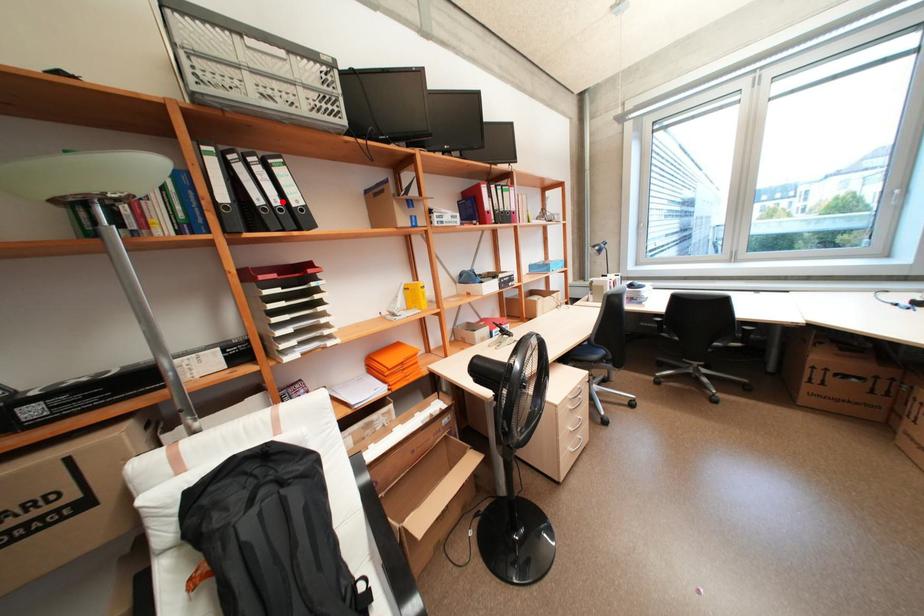
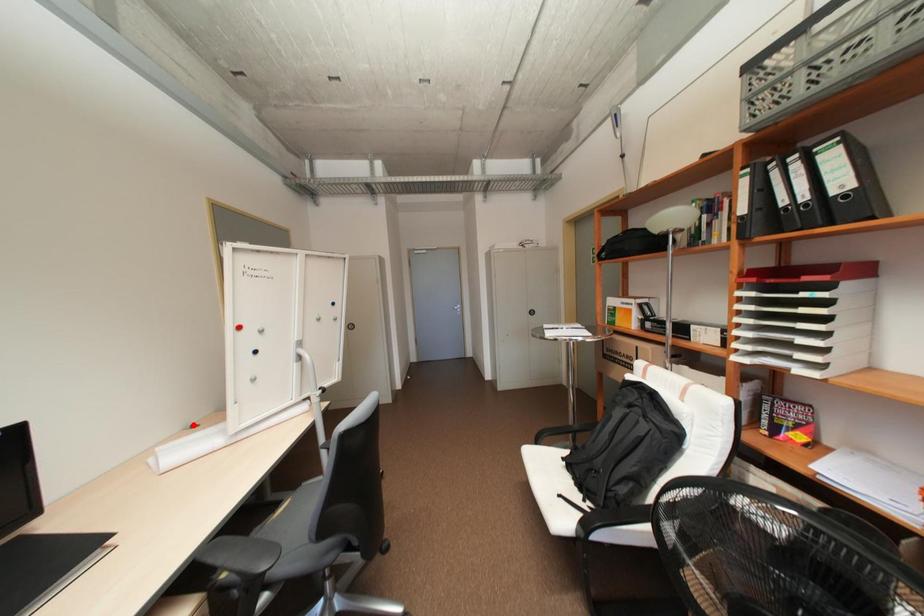
I am providing you with two images of the same scene from different viewpoints. A red point is marked on the first image and another point is marked on the second image. Does the point marked in image1 correspond to the same location as the one in image2?

No